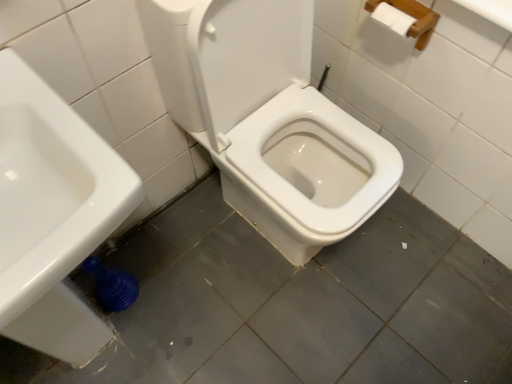
The width and height of the screenshot is (512, 384). Identify the location of free point in front of white glossy toilet at center. pos(300,319).